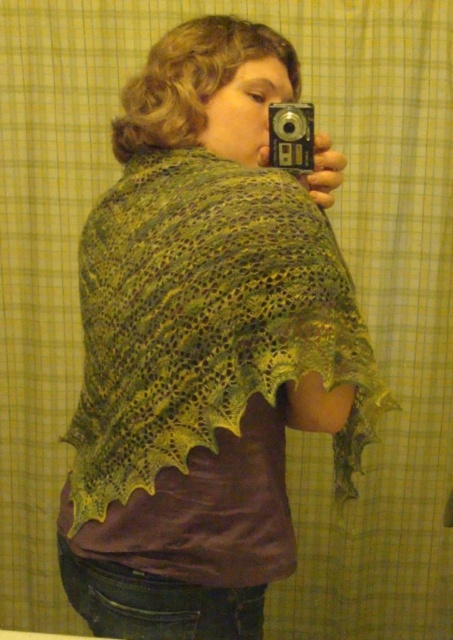
Can you confirm if green lace shawl at upper center is bigger than silver metallic camera at upper center?

Yes.

Is point (326, 196) positioned after point (287, 154)?

Yes, it is behind point (287, 154).

Who is more forward, (x=68, y=440) or (x=273, y=122)?

Positioned in front is point (x=273, y=122).

Find the location of a particular element. green lace shawl at upper center is located at coordinates (206, 346).